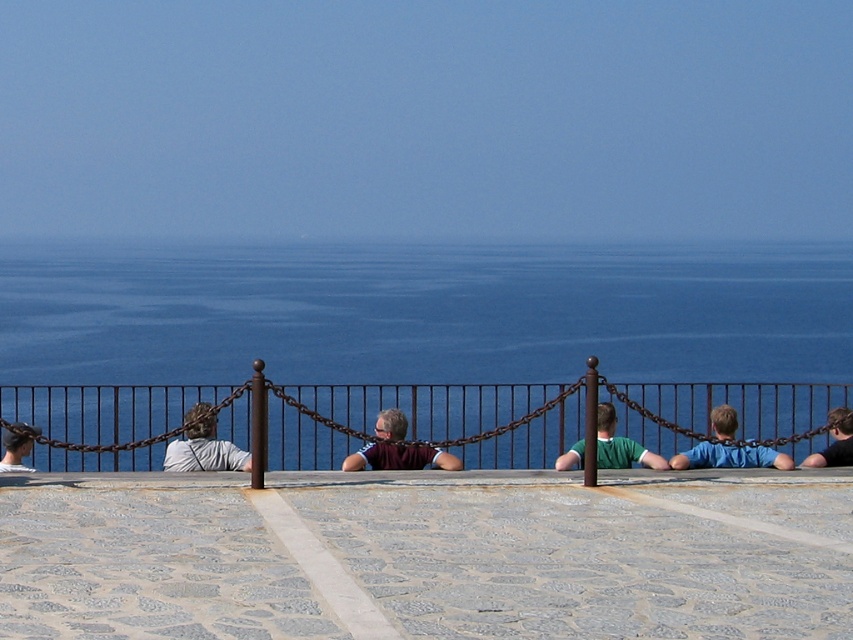
You are standing on the platform and want to hand a seashell to the person wearing the gray fabric shirt at left. Based on their position relative to the railing, can you safely reach them without crossing the railing?

The gray fabric shirt at left is located at point coordinates that place them near the railing. Since the railing is along the edge of the platform, you can safely reach them without crossing the railing as long as you extend your arm appropriately.

You are standing on the platform and want to greet the person wearing the gray fabric shirt at left and the dark blue shirt at center. Which person should you approach first to reach them in the shortest distance?

You should approach the gray fabric shirt at left first because it is closer to the viewer than the dark blue shirt at center, so the shortest distance is to the gray fabric shirt at left.

You are standing on the platform and want to throw a small ball to someone standing on the beach near the blue water at center. If the ball travels in a straight line, how far will it have to go to reach them?

The blue water at center is 13.19 meters away from the viewer, so the ball would need to travel approximately 13.19 meters to reach the person on the beach near the blue water at center.